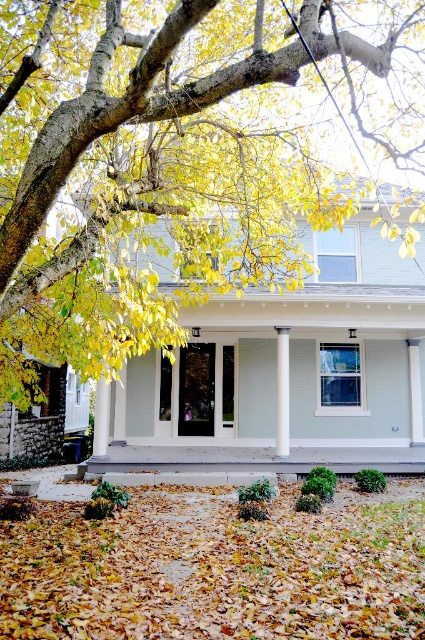
Question: Which of the following is the farthest from the observer?

Choices:
 (A) yellow leafy tree at upper left
 (B) smooth concrete porch at center
 (C) white glossy column at center
 (D) light gray concrete porch at center

Answer: (D)

Question: Can you confirm if yellow leafy tree at upper left is positioned above white glossy column at center?

Choices:
 (A) yes
 (B) no

Answer: (A)

Question: Is brown leaf litter at lower center positioned before light gray concrete porch at center?

Choices:
 (A) no
 (B) yes

Answer: (B)

Question: Among these points, which one is farthest from the camera?

Choices:
 (A) pos(214,620)
 (B) pos(240,442)

Answer: (B)

Question: Can you confirm if yellow leafy tree at upper left is smaller than light gray concrete porch at center?

Choices:
 (A) no
 (B) yes

Answer: (A)

Question: Which of the following is the closest to the observer?

Choices:
 (A) pos(146,467)
 (B) pos(295,29)
 (C) pos(277,364)

Answer: (B)